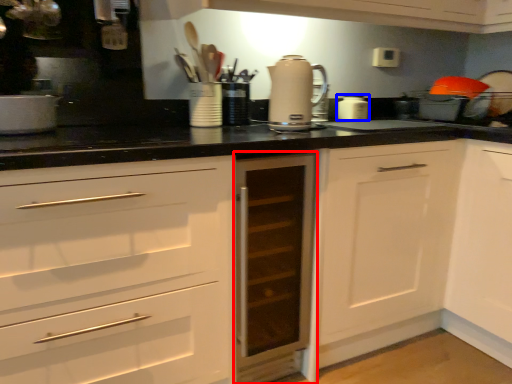
Question: Which point is further to the camera, cabinetry (highlighted by a red box) or kitchen appliance (highlighted by a blue box)?

Choices:
 (A) cabinetry
 (B) kitchen appliance

Answer: (B)